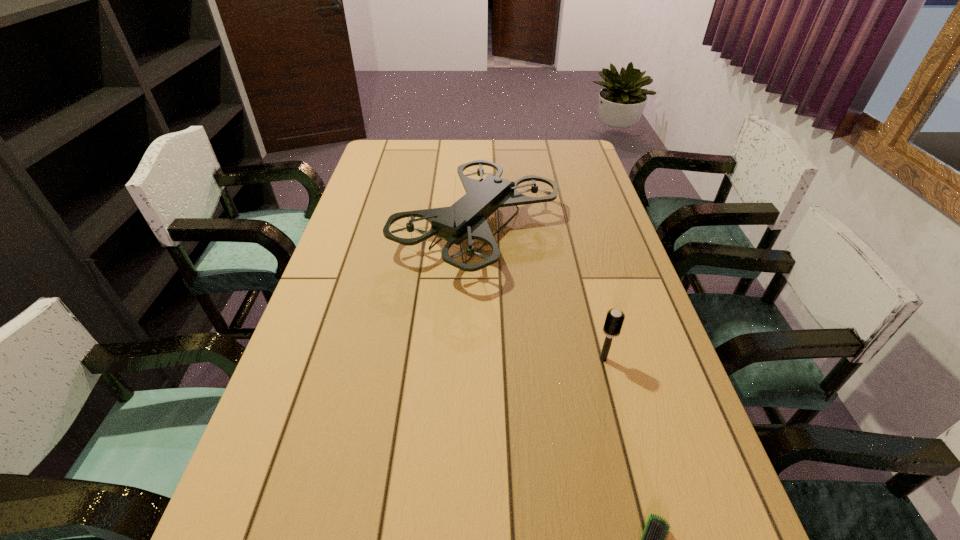
This screenshot has height=540, width=960. In order to click on the tallest object in this screenshot , I will do `click(466, 219)`.

Locate an element on the screen. the farthest object is located at coordinates (466, 219).

Find the location of a particular element. The height and width of the screenshot is (540, 960). the second shortest object is located at coordinates (614, 320).

Find the location of a particular element. This screenshot has height=540, width=960. the farther hairbrush is located at coordinates (614, 320).

Identify the location of free location located 0.060m on the right of the drone. The width and height of the screenshot is (960, 540). (578, 229).

The height and width of the screenshot is (540, 960). Identify the location of free location located 0.240m on the back of the taller hairbrush. (584, 282).

I want to click on object present at the left edge, so click(466, 219).

The width and height of the screenshot is (960, 540). Find the location of `object that is at the right edge`. object that is at the right edge is located at coordinates (614, 320).

In the image, there is a desktop. Where is `vacant area at the far edge`? The width and height of the screenshot is (960, 540). vacant area at the far edge is located at coordinates (443, 145).

Locate an element on the screen. The height and width of the screenshot is (540, 960). vacant space at the left edge of the desktop is located at coordinates (346, 252).